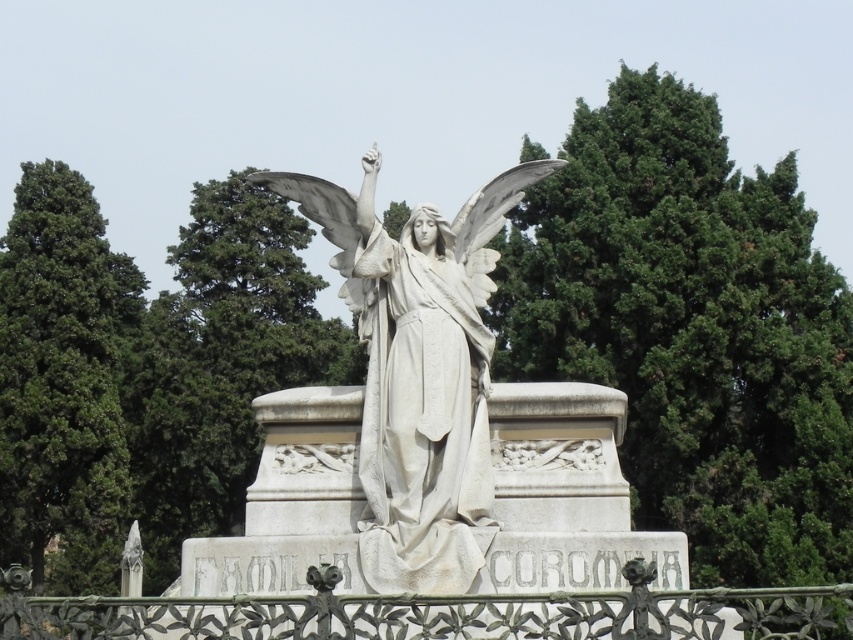
Is green leafy tree at left smaller than wrought iron fence at lower center?

Actually, green leafy tree at left might be larger than wrought iron fence at lower center.

Can you confirm if green leafy tree at left is shorter than wrought iron fence at lower center?

No.

What are the coordinates of `green leafy tree at left` in the screenshot? It's located at (62, 384).

The height and width of the screenshot is (640, 853). I want to click on green leafy tree at left, so click(x=62, y=384).

Can you confirm if white marble statue at center is taller than wrought iron fence at lower center?

Indeed, white marble statue at center has a greater height compared to wrought iron fence at lower center.

Is white marble statue at center wider than wrought iron fence at lower center?

In fact, white marble statue at center might be narrower than wrought iron fence at lower center.

Which is in front, point (402, 422) or point (181, 636)?

Positioned in front is point (181, 636).

Find the location of a particular element. The height and width of the screenshot is (640, 853). white marble statue at center is located at coordinates (418, 371).

Does point (807, 209) come behind point (537, 170)?

Yes, it is behind point (537, 170).

The image size is (853, 640). I want to click on green leafy tree at upper center, so click(x=691, y=330).